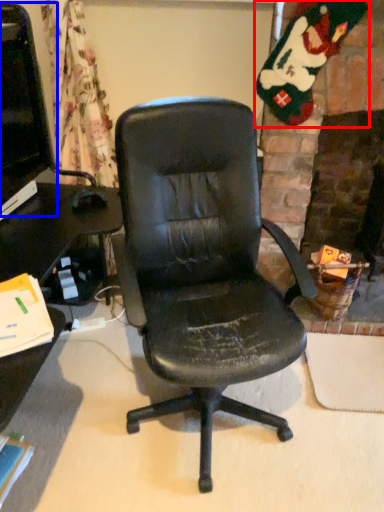
Question: Among these objects, which one is farthest to the camera, santa claus (highlighted by a red box) or computer monitor (highlighted by a blue box)?

Choices:
 (A) santa claus
 (B) computer monitor

Answer: (A)